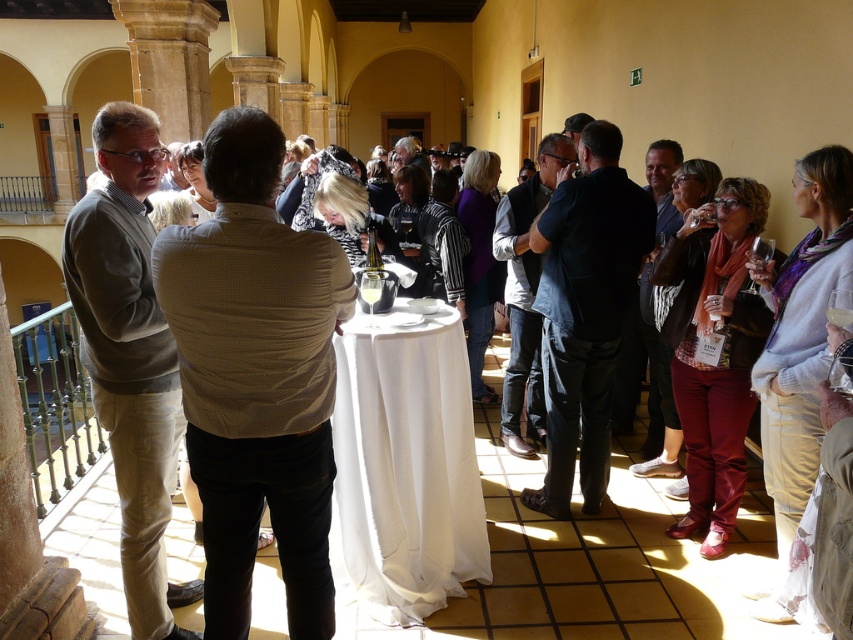
You are standing at the entrance of the courtyard and want to reach a specific location. You see two points marked in the scene. The first point is at coordinates point (123,132), and the second is at point (662,445). If you want to move from the entrance towards the first point, will you pass by the second point on your way?

Point (123,132) is in front of point (662,445), so moving towards the first point means you are approaching it directly and would not pass by the second point on the way.

You are attending a formal event in this courtyard and notice two dark blue outfits at the center. Which one is closer to the floor, the dark blue shirt at center or the dark blue suit at center?

The dark blue shirt at center is positioned under the dark blue suit at center, so it is closer to the floor.